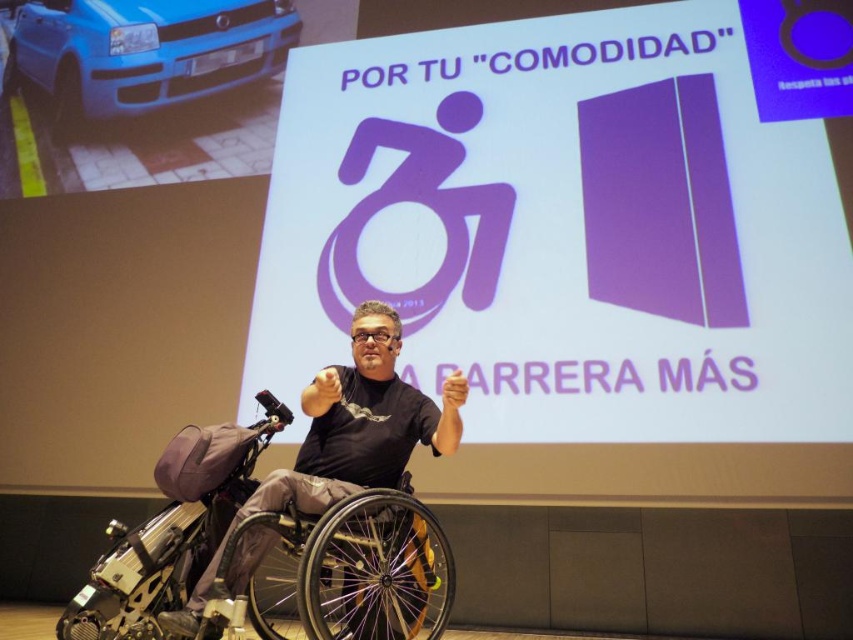
You are navigating a virtual 3D model of the scene described. You need to move from point A to point B. Point A is at coordinates point (x=769, y=1) and point B is at coordinates point (x=245, y=13). Which point is closer to you, the viewer, as you start your journey?

Point (x=769, y=1) is closer to the viewer than point (x=245, y=13), so you will start closer to point A.

You are an accessibility consultant assessing the setup of a presentation room. You notice the silver metallic wheelchair at center and the purple matte projection screen at upper center. Based on their positions, is the wheelchair positioned in a way that allows the presenter to face the screen comfortably?

The silver metallic wheelchair at center is behind the purple matte projection screen at upper center, so the wheelchair is positioned behind the screen, which would block the presenter from facing the screen comfortably. The presenter cannot see the screen from that position.